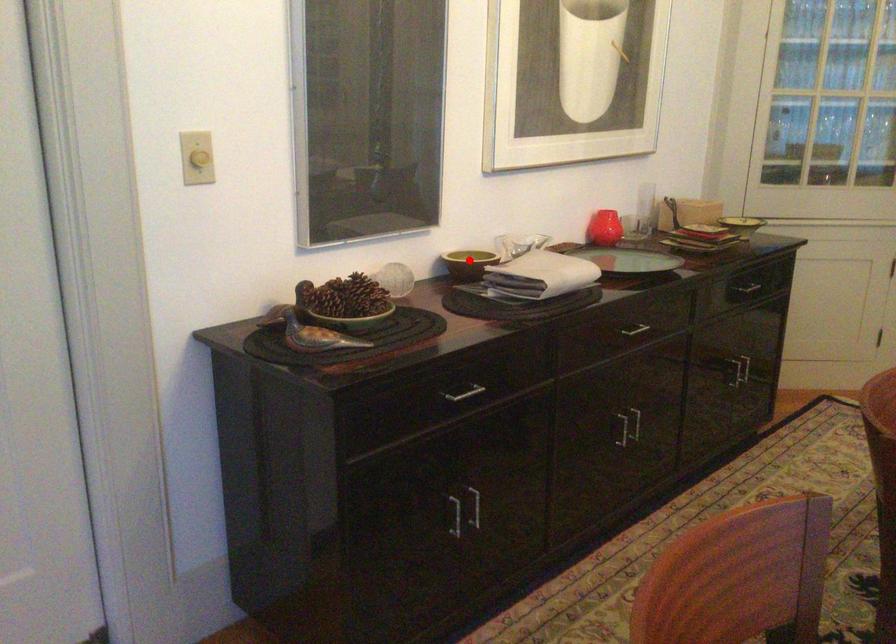
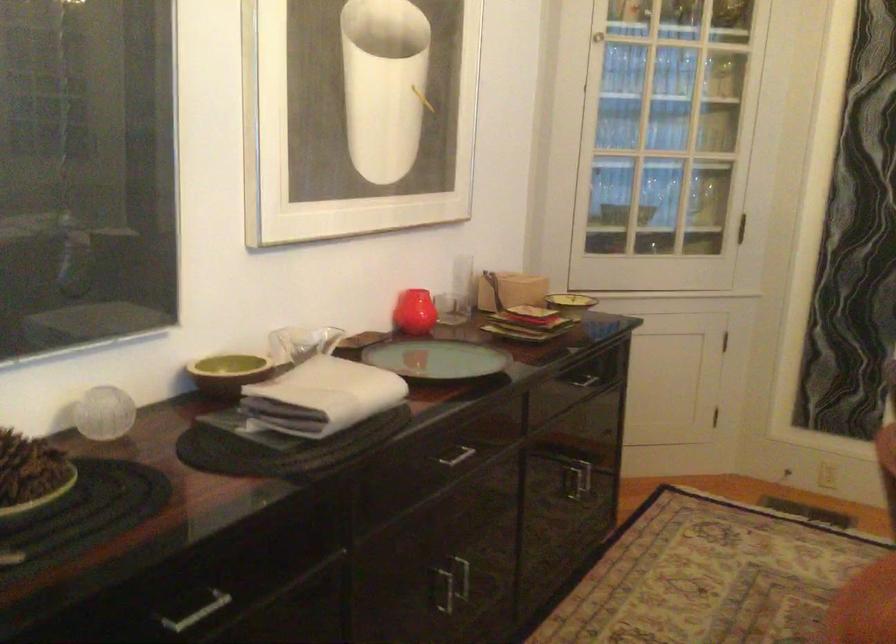
Find the pixel in the second image that matches the highlighted location in the first image.

(228, 373)